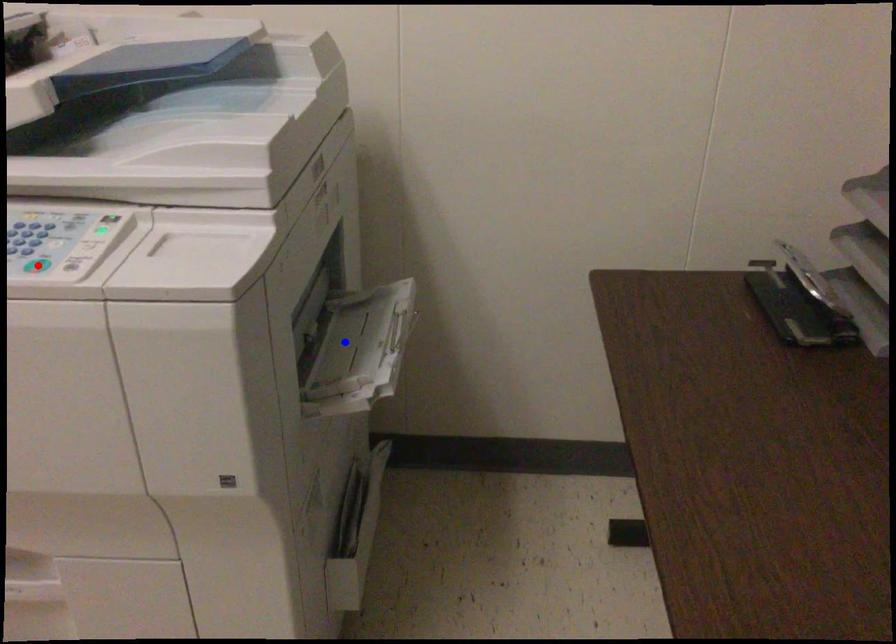
Question: Two points are marked on the image. Which point is closer to the camera?

Choices:
 (A) Blue point is closer.
 (B) Red point is closer.

Answer: (B)